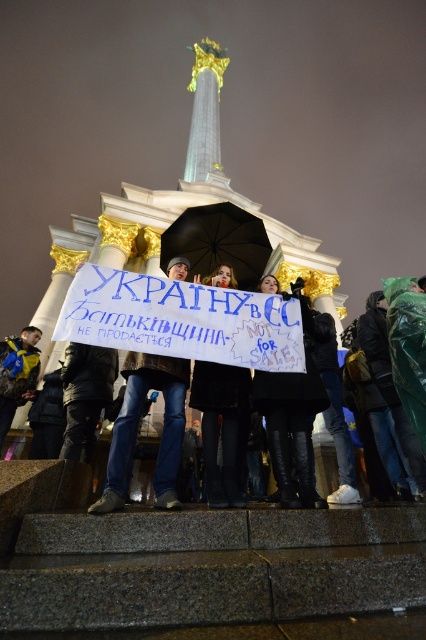
Which is behind, point (232, 413) or point (256, 269)?

The point (256, 269) is more distant.

Is point (221, 266) positioned before point (236, 205)?

That is True.

What do you see at coordinates (221, 428) in the screenshot? I see `black fur coat at center` at bounding box center [221, 428].

This screenshot has height=640, width=426. I want to click on black fur coat at center, so click(221, 428).

Who is higher up, blue jeans at center or black matte umbrella at center?

black matte umbrella at center

Is blue jeans at center smaller than black matte umbrella at center?

No, blue jeans at center is not smaller than black matte umbrella at center.

Measure the distance between blue jeans at center and camera.

130.32 feet

This screenshot has height=640, width=426. In order to click on blue jeans at center in this screenshot , I will do `click(138, 426)`.

Does black leather boots at lower center have a greater width compared to black fur coat at center?

Yes, black leather boots at lower center is wider than black fur coat at center.

Between point (307, 474) and point (221, 410), which one is positioned in front?

Positioned in front is point (307, 474).

The width and height of the screenshot is (426, 640). What are the coordinates of `black leather boots at lower center` in the screenshot? It's located at (293, 419).